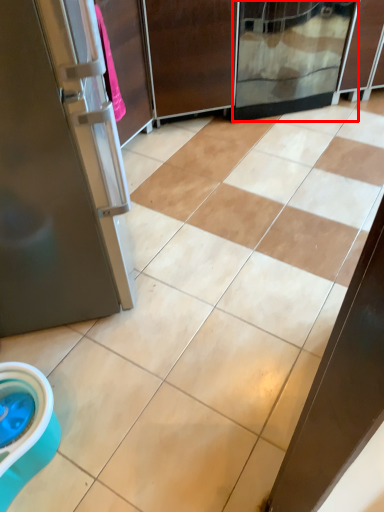
Question: From the image's perspective, what is the correct spatial relationship of screen door (annotated by the red box) in relation to screen door?

Choices:
 (A) above
 (B) below

Answer: (A)